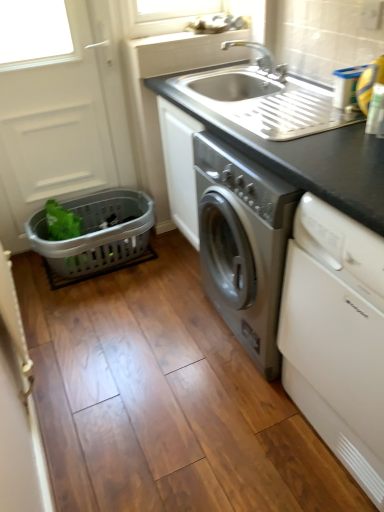
Identify the location of free space in front of gray plastic basket at lower left. The height and width of the screenshot is (512, 384). (104, 320).